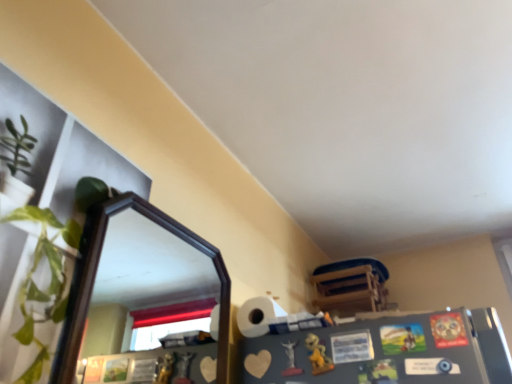
Describe the element at coordinates (291, 360) in the screenshot. I see `matte plastic statue at lower center, positioned as the second toy in right-to-left order` at that location.

What is the approximate width of black wooden mirror at upper left?

The width of black wooden mirror at upper left is 2.15 inches.

What do you see at coordinates (318, 355) in the screenshot?
I see `yellow matte toy at lower center, placed as the first toy when sorted from right to left` at bounding box center [318, 355].

Locate an element on the screen. This screenshot has width=512, height=384. matte plastic statue at lower center, positioned as the second toy in right-to-left order is located at coordinates (291, 360).

Is wooden chair at upper right facing away from matte plastic statue at lower center, marked as the first toy in a left-to-right arrangement?

No, wooden chair at upper right is not facing the opposite direction of matte plastic statue at lower center, marked as the first toy in a left-to-right arrangement.

From a real-world perspective, is wooden chair at upper right on top of matte plastic statue at lower center, positioned as the second toy in right-to-left order?

Yes.

From a real-world perspective, which is physically below, yellow matte toy at lower center, placed as the first toy when sorted from right to left, or black wooden mirror at upper left?

yellow matte toy at lower center, placed as the first toy when sorted from right to left.

Can you see yellow matte toy at lower center, placed as the first toy when sorted from right to left, touching black wooden mirror at upper left?

No, yellow matte toy at lower center, placed as the first toy when sorted from right to left, is not touching black wooden mirror at upper left.

Is yellow matte toy at lower center, placed as the first toy when sorted from right to left, surrounding black wooden mirror at upper left?

No.

From the image's perspective, which one is positioned higher, yellow matte toy at lower center, placed as the first toy when sorted from right to left, or black wooden mirror at upper left?

From the image's view, black wooden mirror at upper left is above.

Does matte plastic statue at lower center, marked as the first toy in a left-to-right arrangement, contain wooden chair at upper right?

Definitely not — wooden chair at upper right is not inside matte plastic statue at lower center, marked as the first toy in a left-to-right arrangement.

Is matte plastic statue at lower center, marked as the first toy in a left-to-right arrangement, turned away from wooden chair at upper right?

matte plastic statue at lower center, marked as the first toy in a left-to-right arrangement, does not have its back to wooden chair at upper right.

From the image's perspective, is matte plastic statue at lower center, positioned as the second toy in right-to-left order, located above or below wooden chair at upper right?

matte plastic statue at lower center, positioned as the second toy in right-to-left order, is situated higher than wooden chair at upper right in the image.

Based on the photo, is matte plastic statue at lower center, marked as the first toy in a left-to-right arrangement, next to wooden chair at upper right and touching it?

No, matte plastic statue at lower center, marked as the first toy in a left-to-right arrangement, is not beside wooden chair at upper right.

Considering the relative sizes of wooden chair at upper right and yellow matte toy at lower center, placed as the first toy when sorted from right to left, in the image provided, is wooden chair at upper right shorter than yellow matte toy at lower center, placed as the first toy when sorted from right to left,?

In fact, wooden chair at upper right may be taller than yellow matte toy at lower center, placed as the first toy when sorted from right to left.

Which is behind, wooden chair at upper right or yellow matte toy at lower center, acting as the second toy starting from the left?

Positioned behind is wooden chair at upper right.

Choose the correct answer: Is wooden chair at upper right inside yellow matte toy at lower center, acting as the second toy starting from the left, or outside it?

wooden chair at upper right cannot be found inside yellow matte toy at lower center, acting as the second toy starting from the left.

Which is nearer, (x=340, y=307) or (x=314, y=347)?

Positioned in front is point (x=314, y=347).

Is black wooden mirror at upper left facing away from matte plastic statue at lower center, positioned as the second toy in right-to-left order?

No, matte plastic statue at lower center, positioned as the second toy in right-to-left order, is not at the back of black wooden mirror at upper left.

Based on the photo, does black wooden mirror at upper left have a lesser width compared to matte plastic statue at lower center, positioned as the second toy in right-to-left order?

No, black wooden mirror at upper left is not thinner than matte plastic statue at lower center, positioned as the second toy in right-to-left order.

In the image, is black wooden mirror at upper left on the left side or the right side of matte plastic statue at lower center, positioned as the second toy in right-to-left order?

black wooden mirror at upper left is to the left of matte plastic statue at lower center, positioned as the second toy in right-to-left order.

Is the position of black wooden mirror at upper left more distant than that of matte plastic statue at lower center, marked as the first toy in a left-to-right arrangement?

No, black wooden mirror at upper left is closer to the camera.

Based on the photo, between black wooden mirror at upper left and yellow matte toy at lower center, placed as the first toy when sorted from right to left, which one has smaller size?

yellow matte toy at lower center, placed as the first toy when sorted from right to left.

Is black wooden mirror at upper left positioned far away from yellow matte toy at lower center, placed as the first toy when sorted from right to left?

Yes, black wooden mirror at upper left is far from yellow matte toy at lower center, placed as the first toy when sorted from right to left.

Choose the correct answer: Is black wooden mirror at upper left inside yellow matte toy at lower center, placed as the first toy when sorted from right to left, or outside it?

black wooden mirror at upper left is outside yellow matte toy at lower center, placed as the first toy when sorted from right to left.

Can you confirm if black wooden mirror at upper left is thinner than yellow matte toy at lower center, placed as the first toy when sorted from right to left?

Incorrect, the width of black wooden mirror at upper left is not less than that of yellow matte toy at lower center, placed as the first toy when sorted from right to left.

Consider the image. From the image's perspective, between black wooden mirror at upper left and wooden chair at upper right, which one is located above?

black wooden mirror at upper left, from the image's perspective.

Is black wooden mirror at upper left bigger or smaller than wooden chair at upper right?

Clearly, black wooden mirror at upper left is smaller in size than wooden chair at upper right.

Is black wooden mirror at upper left at the left side of wooden chair at upper right?

Indeed, black wooden mirror at upper left is positioned on the left side of wooden chair at upper right.

Is black wooden mirror at upper left positioned beyond the bounds of wooden chair at upper right?

Yes, black wooden mirror at upper left is outside of wooden chair at upper right.

This screenshot has height=384, width=512. In order to click on furniture that is behind the matte plastic statue at lower center, marked as the first toy in a left-to-right arrangement in this screenshot , I will do [x=351, y=286].

From a real-world perspective, starting from the black wooden mirror at upper left, which toy is the 2nd one below it? Please provide its 2D coordinates.

[(318, 355)]

From the image, which object appears to be nearer to yellow matte toy at lower center, placed as the first toy when sorted from right to left, black wooden mirror at upper left or matte plastic statue at lower center, positioned as the second toy in right-to-left order?

Based on the image, matte plastic statue at lower center, positioned as the second toy in right-to-left order, appears to be nearer to yellow matte toy at lower center, placed as the first toy when sorted from right to left.

Which object lies further to the anchor point black wooden mirror at upper left, yellow matte toy at lower center, placed as the first toy when sorted from right to left, or wooden chair at upper right?

yellow matte toy at lower center, placed as the first toy when sorted from right to left.

Considering their positions, is wooden chair at upper right positioned closer to black wooden mirror at upper left than matte plastic statue at lower center, positioned as the second toy in right-to-left order?

wooden chair at upper right is positioned closer to the anchor black wooden mirror at upper left.

From the image, which object appears to be nearer to black wooden mirror at upper left, matte plastic statue at lower center, positioned as the second toy in right-to-left order, or wooden chair at upper right?

wooden chair at upper right lies closer to black wooden mirror at upper left than the other object.

Looking at the image, which one is located further to matte plastic statue at lower center, positioned as the second toy in right-to-left order, yellow matte toy at lower center, acting as the second toy starting from the left, or black wooden mirror at upper left?

black wooden mirror at upper left.

From the image, which object appears to be farther from yellow matte toy at lower center, placed as the first toy when sorted from right to left, matte plastic statue at lower center, marked as the first toy in a left-to-right arrangement, or wooden chair at upper right?

The object further to yellow matte toy at lower center, placed as the first toy when sorted from right to left, is wooden chair at upper right.

Looking at the image, which one is located closer to yellow matte toy at lower center, acting as the second toy starting from the left, wooden chair at upper right or black wooden mirror at upper left?

wooden chair at upper right is closer to yellow matte toy at lower center, acting as the second toy starting from the left.

When comparing their distances from matte plastic statue at lower center, positioned as the second toy in right-to-left order, does wooden chair at upper right or black wooden mirror at upper left seem further?

Among the two, black wooden mirror at upper left is located further to matte plastic statue at lower center, positioned as the second toy in right-to-left order.

Locate an element on the screen. toy located between yellow matte toy at lower center, acting as the second toy starting from the left, and wooden chair at upper right in the depth direction is located at coordinates (291, 360).

The width and height of the screenshot is (512, 384). I want to click on toy between black wooden mirror at upper left and matte plastic statue at lower center, marked as the first toy in a left-to-right arrangement, along the z-axis, so click(x=318, y=355).